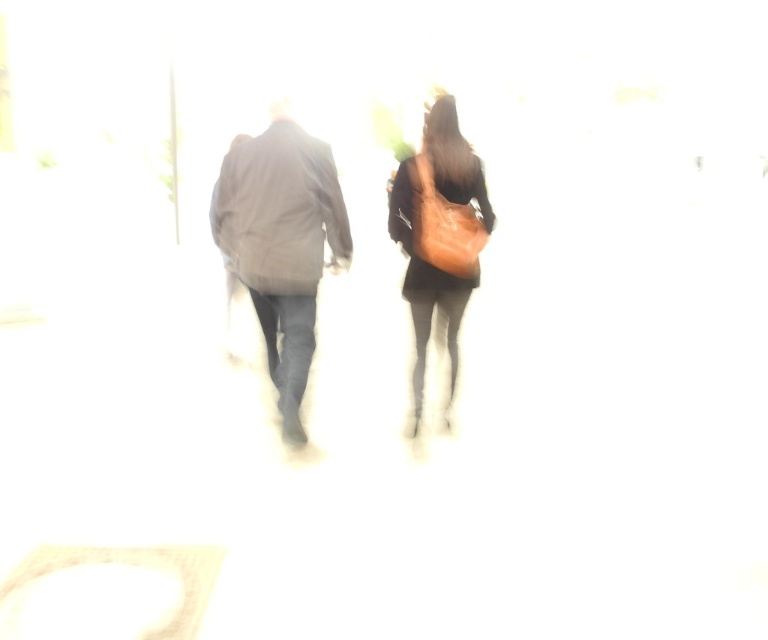
Question: Is matte black coat at center smaller than leather brown bag at center?

Choices:
 (A) no
 (B) yes

Answer: (A)

Question: Which object is farther from the camera taking this photo?

Choices:
 (A) matte orange bag at right
 (B) leather brown bag at center

Answer: (A)

Question: Among these objects, which one is nearest to the camera?

Choices:
 (A) matte black coat at center
 (B) leather brown bag at center
 (C) matte orange bag at right

Answer: (B)

Question: Which object appears farthest from the camera in this image?

Choices:
 (A) dark gray suit at center
 (B) matte black coat at center

Answer: (B)

Question: Does matte black coat at center have a greater width compared to dark gray suit at center?

Choices:
 (A) yes
 (B) no

Answer: (B)

Question: Can you confirm if dark gray suit at center is positioned to the right of leather brown bag at center?

Choices:
 (A) yes
 (B) no

Answer: (B)